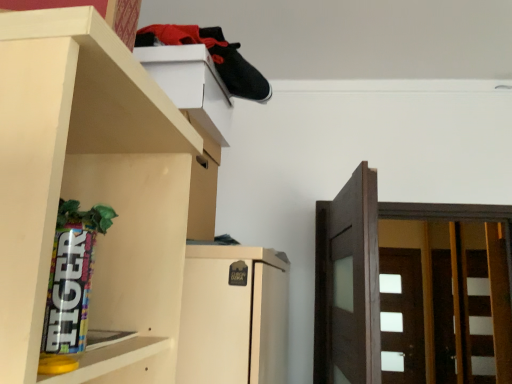
Question: From the image's perspective, is white glossy door at right, the second door viewed from the front, on white matte cabinet at upper center?

Choices:
 (A) yes
 (B) no

Answer: (B)

Question: From the image's perspective, is white glossy door at right, which is the 1th door in back-to-front order, below white matte cabinet at upper center?

Choices:
 (A) no
 (B) yes

Answer: (B)

Question: Can you confirm if white glossy door at right, the first door when ordered from right to left, is positioned to the right of white matte cabinet at upper center?

Choices:
 (A) yes
 (B) no

Answer: (A)

Question: Is white glossy door at right, which is the 1th door in back-to-front order, wider than white matte cabinet at upper center?

Choices:
 (A) no
 (B) yes

Answer: (A)

Question: Considering the relative positions of white glossy door at right, which is the second door from left to right, and white matte cabinet at upper center in the image provided, is white glossy door at right, which is the second door from left to right, in front of white matte cabinet at upper center?

Choices:
 (A) no
 (B) yes

Answer: (A)

Question: From a real-world perspective, is white glossy door at right, marked as the 2th door in a top-to-bottom arrangement, located higher than white matte cabinet at upper center?

Choices:
 (A) no
 (B) yes

Answer: (A)

Question: Can you confirm if white matte cabinet at upper center is thinner than white glossy door at right, arranged as the first door when ordered from the bottom?

Choices:
 (A) yes
 (B) no

Answer: (B)

Question: Is white matte cabinet at upper center facing towards white glossy door at right, arranged as the first door when ordered from the bottom?

Choices:
 (A) yes
 (B) no

Answer: (B)

Question: Is white matte cabinet at upper center outside white glossy door at right, the first door when ordered from right to left?

Choices:
 (A) yes
 (B) no

Answer: (A)

Question: Is white matte cabinet at upper center bigger than white glossy door at right, marked as the 2th door in a top-to-bottom arrangement?

Choices:
 (A) yes
 (B) no

Answer: (B)

Question: From a real-world perspective, is white matte cabinet at upper center under white glossy door at right, the first door when ordered from right to left?

Choices:
 (A) yes
 (B) no

Answer: (B)

Question: Is white matte cabinet at upper center to the right of white glossy door at right, which is the 1th door in back-to-front order, from the viewer's perspective?

Choices:
 (A) yes
 (B) no

Answer: (B)

Question: Is dark brown wood door at right, placed as the second door when sorted from back to front, further to the viewer compared to white glossy door at right, which is the second door from left to right?

Choices:
 (A) no
 (B) yes

Answer: (A)